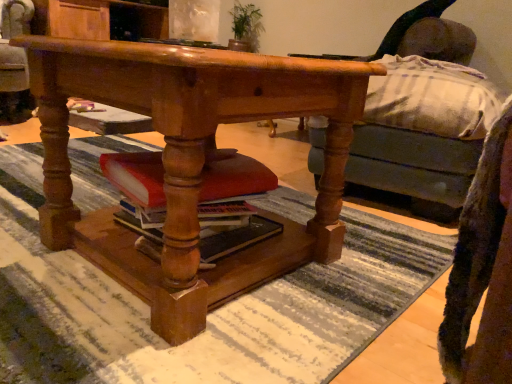
Question: From the image's perspective, is matte red book at center under wooden swivel chair at center?

Choices:
 (A) yes
 (B) no

Answer: (A)

Question: Considering the relative sizes of matte red book at center and wooden swivel chair at center in the image provided, is matte red book at center smaller than wooden swivel chair at center?

Choices:
 (A) no
 (B) yes

Answer: (B)

Question: Does matte red book at center have a lesser width compared to wooden swivel chair at center?

Choices:
 (A) yes
 (B) no

Answer: (A)

Question: Does matte red book at center appear on the left side of wooden swivel chair at center?

Choices:
 (A) no
 (B) yes

Answer: (A)

Question: Does matte red book at center have a larger size compared to wooden swivel chair at center?

Choices:
 (A) yes
 (B) no

Answer: (B)

Question: In the image, is matte red book at center on the left side or the right side of wooden swivel chair at center?

Choices:
 (A) left
 (B) right

Answer: (B)

Question: From the image's perspective, is matte red book at center positioned above or below wooden swivel chair at center?

Choices:
 (A) below
 (B) above

Answer: (A)

Question: Relative to wooden swivel chair at center, is matte red book at center in front or behind?

Choices:
 (A) front
 (B) behind

Answer: (A)

Question: Is point (229, 226) positioned closer to the camera than point (11, 69)?

Choices:
 (A) closer
 (B) farther

Answer: (A)

Question: From the image's perspective, relative to matte red book at center, is wooden desk at center above or below?

Choices:
 (A) above
 (B) below

Answer: (A)

Question: Is point (60, 220) positioned closer to the camera than point (220, 236)?

Choices:
 (A) closer
 (B) farther

Answer: (B)

Question: Considering their positions, is wooden desk at center located in front of or behind matte red book at center?

Choices:
 (A) behind
 (B) front

Answer: (B)

Question: Is wooden desk at center to the left or to the right of matte red book at center in the image?

Choices:
 (A) left
 (B) right

Answer: (B)

Question: Is point (18, 28) closer or farther from the camera than point (173, 172)?

Choices:
 (A) farther
 (B) closer

Answer: (A)

Question: From the image's perspective, is wooden swivel chair at center above or below wooden desk at center?

Choices:
 (A) below
 (B) above

Answer: (B)